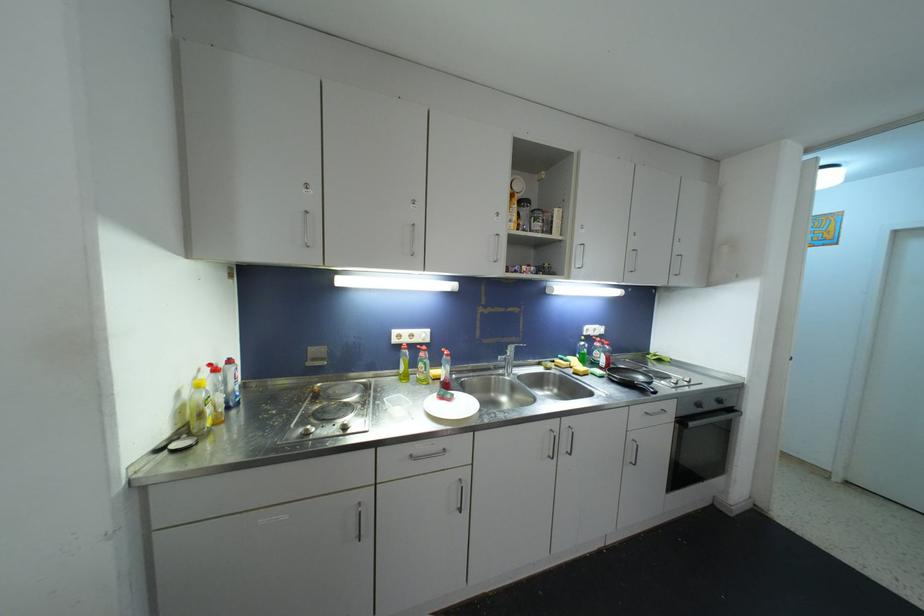
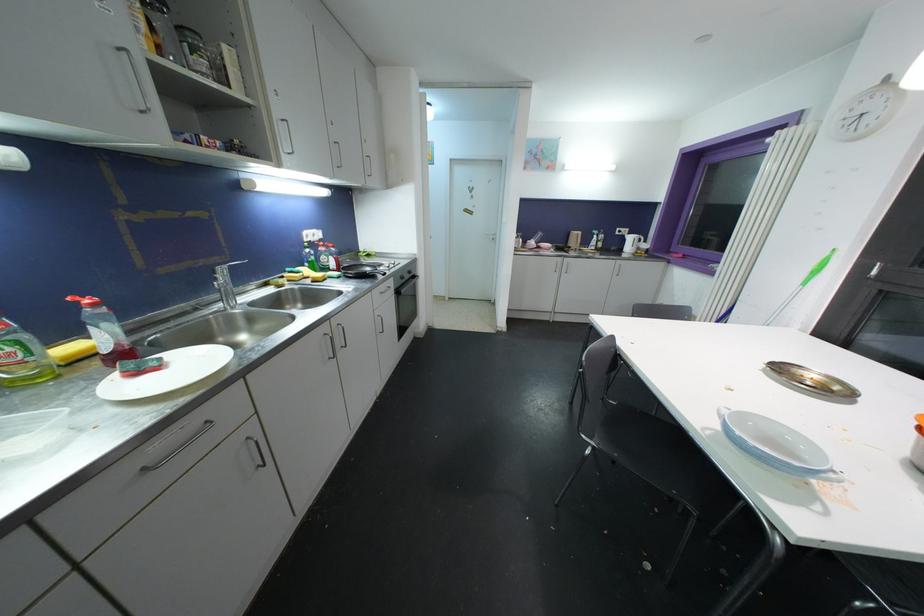
Where in the second image is the point corresponding to pixel 569 424 from the first image?

(337, 323)